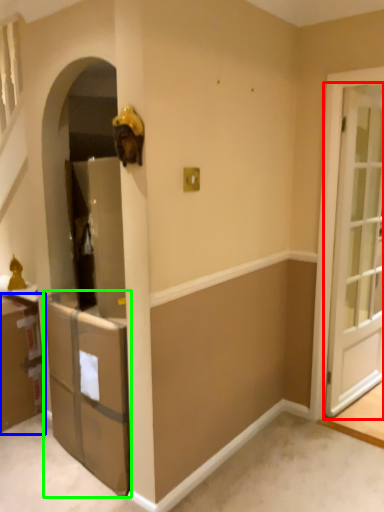
Question: Which is farther away from door (highlighted by a red box)? cabinetry (highlighted by a blue box) or cabinetry (highlighted by a green box)?

Choices:
 (A) cabinetry
 (B) cabinetry

Answer: (A)